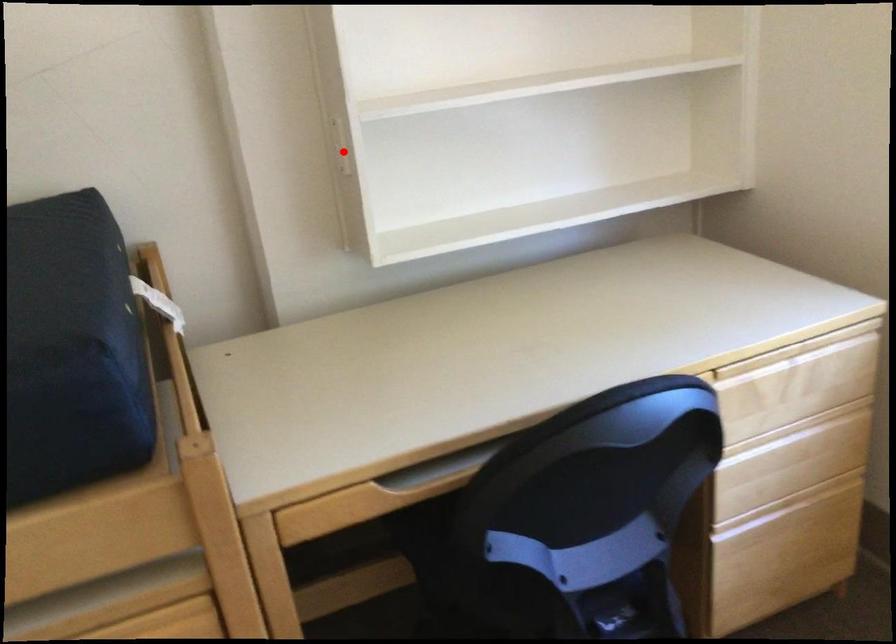
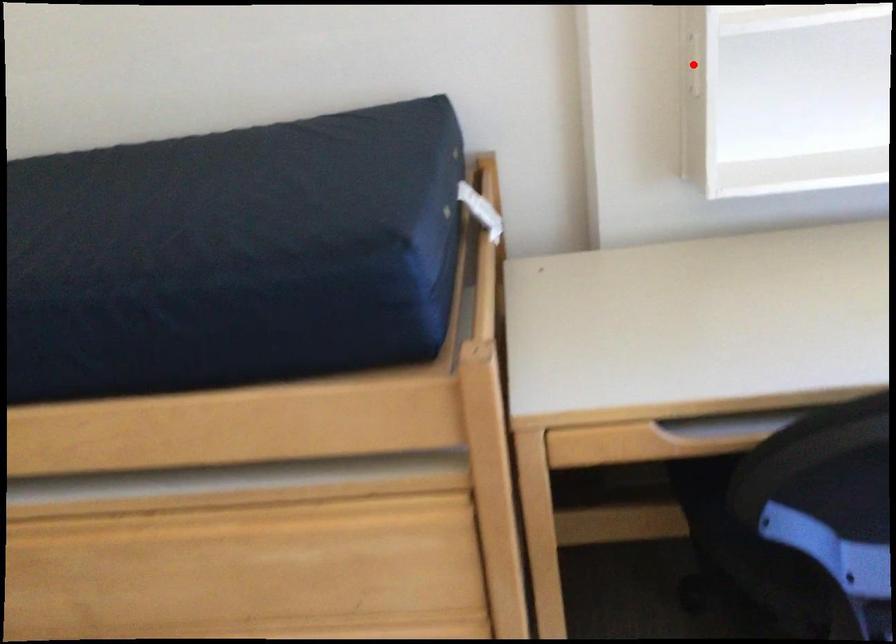
I am providing you with two images of the same scene from different viewpoints. A red point is marked on the first image and another point is marked on the second image. Does the point marked in image1 correspond to the same location as the one in image2?

Yes